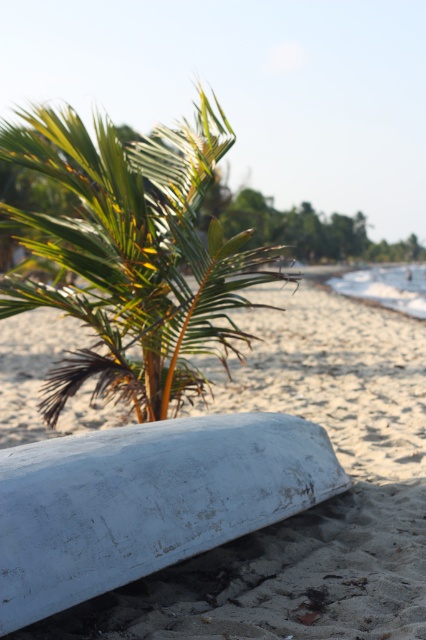
Does white sandy beach at lower center have a lesser width compared to green leafy palm tree at center?

Yes.

Which is more to the right, white sandy beach at lower center or green leafy palm tree at center?

white sandy beach at lower center

The image size is (426, 640). I want to click on white sandy beach at lower center, so click(x=310, y=508).